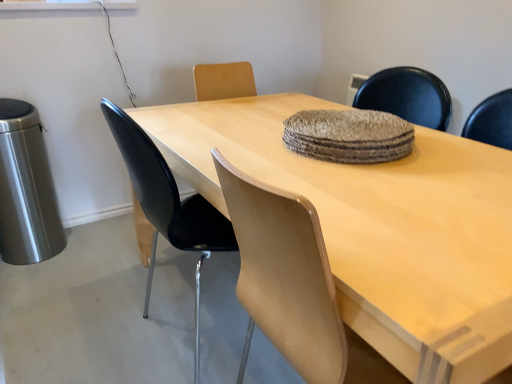
Question: Considering the relative positions of textured woven mat at center and light wood table at center in the image provided, is textured woven mat at center to the left or to the right of light wood table at center?

Choices:
 (A) left
 (B) right

Answer: (B)

Question: From the image's perspective, relative to light wood table at center, is textured woven mat at center above or below?

Choices:
 (A) above
 (B) below

Answer: (A)

Question: Estimate the real-world distances between objects in this image. Which object is closer to the textured woven mat at center?

Choices:
 (A) black plastic chair at left
 (B) light wood table at center

Answer: (B)

Question: Based on their relative distances, which object is nearer to the textured woven mat at center?

Choices:
 (A) black plastic chair at left
 (B) light wood table at center

Answer: (B)